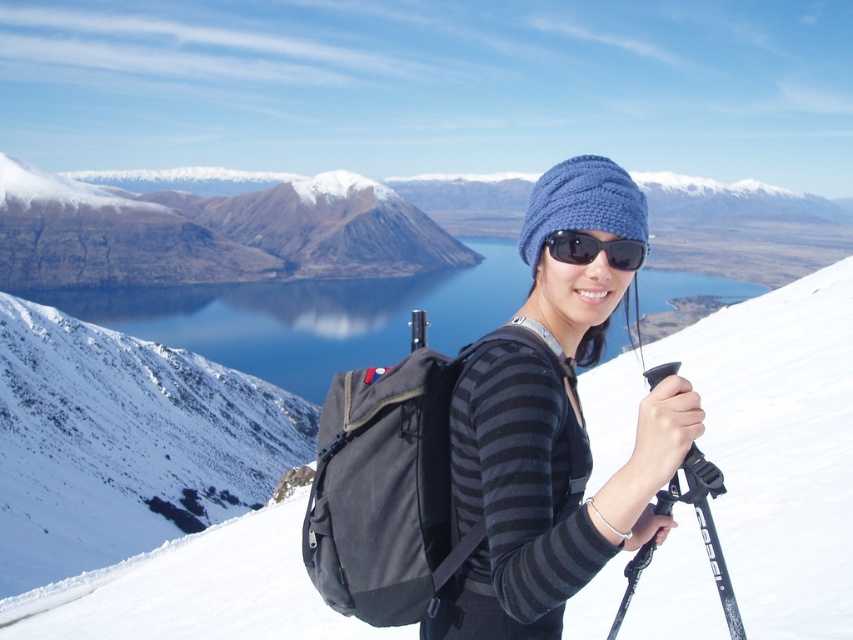
Looking at this image, is matte black backpack at center taller than blue water at center?

No, matte black backpack at center is not taller than blue water at center.

Based on the photo, does matte black backpack at center come in front of blue water at center?

Yes.

Where is `matte black backpack at center`? matte black backpack at center is located at coordinates pos(780,449).

Is matte black backpack at center taller than brown textured mountain at upper left?

Incorrect, matte black backpack at center's height is not larger of brown textured mountain at upper left's.

Locate an element on the screen. The image size is (853, 640). matte black backpack at center is located at coordinates (780, 449).

You are a GUI agent. You are given a task and a screenshot of the screen. Output one action in this format:
    pyautogui.click(x=<x>, y=<y>)
    Task: Click on the matte black backpack at center
    This screenshot has width=853, height=640.
    Given the screenshot: What is the action you would take?
    pyautogui.click(x=780, y=449)

Is black canvas backpack at center wider than black plastic ski pole at lower right?

Correct, the width of black canvas backpack at center exceeds that of black plastic ski pole at lower right.

Between black canvas backpack at center and black plastic ski pole at lower right, which one appears on the left side from the viewer's perspective?

black canvas backpack at center

Which is in front, point (335, 525) or point (665, 369)?

Point (335, 525)

This screenshot has height=640, width=853. In order to click on black canvas backpack at center in this screenshot , I will do `click(404, 481)`.